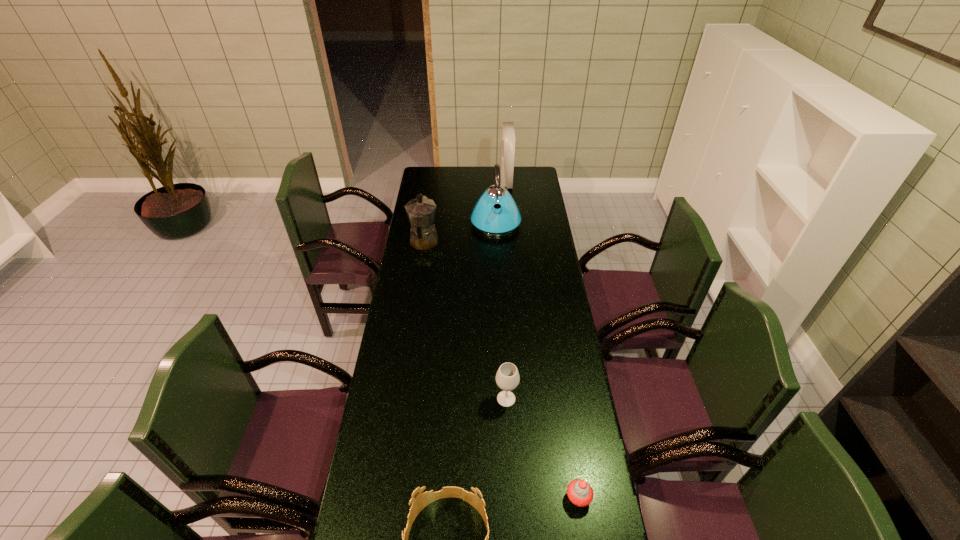
This screenshot has width=960, height=540. In order to click on kettle in this screenshot , I will do `click(487, 219)`.

Identify the location of the farthest object. (507, 149).

Where is `the leftmost object`? The image size is (960, 540). the leftmost object is located at coordinates (421, 211).

Locate an element on the screen. The width and height of the screenshot is (960, 540). the fourth shortest object is located at coordinates (421, 211).

Identify the location of the fourth farthest object. The width and height of the screenshot is (960, 540). (507, 378).

At what (x,y) coordinates should I click in order to perform the action: click on cupcake. Please return your answer as a coordinate pair (x, y). Looking at the image, I should click on (579, 492).

At what (x,y) coordinates should I click in order to perform the action: click on the rightmost object. Please return your answer as a coordinate pair (x, y). Looking at the image, I should click on (579, 492).

Identify the location of free location located 0.130m at the spout of the kettle. (497, 256).

You are a GUI agent. You are given a task and a screenshot of the screen. Output one action in this format:
    pyautogui.click(x=<x>, y=<y>)
    Task: Click on the vacant region located 0.200m on the front-facing side of the farthest object
    
    Given the screenshot: What is the action you would take?
    pyautogui.click(x=467, y=181)

What are the coordinates of `vacant space located 0.340m on the front-facing side of the farthest object` in the screenshot? It's located at (443, 181).